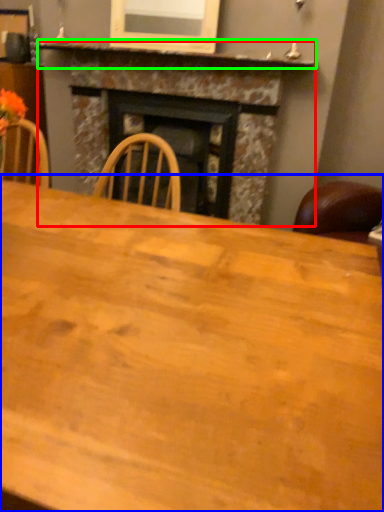
Question: Which object is positioned farthest from fireplace (highlighted by a red box)? Select from table (highlighted by a blue box) and mantle (highlighted by a green box).

Choices:
 (A) table
 (B) mantle

Answer: (A)